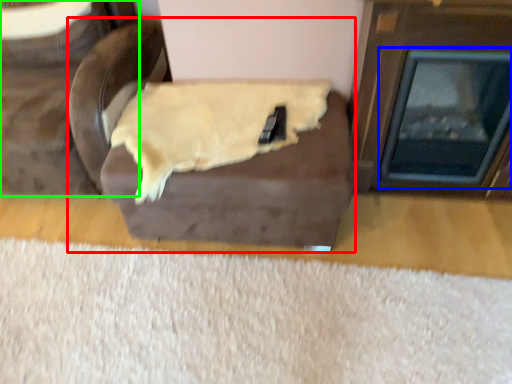
Question: Which object is the closest to the furniture (highlighted by a red box)? Choose among these: fireplace (highlighted by a blue box) or furniture (highlighted by a green box).

Choices:
 (A) fireplace
 (B) furniture

Answer: (B)